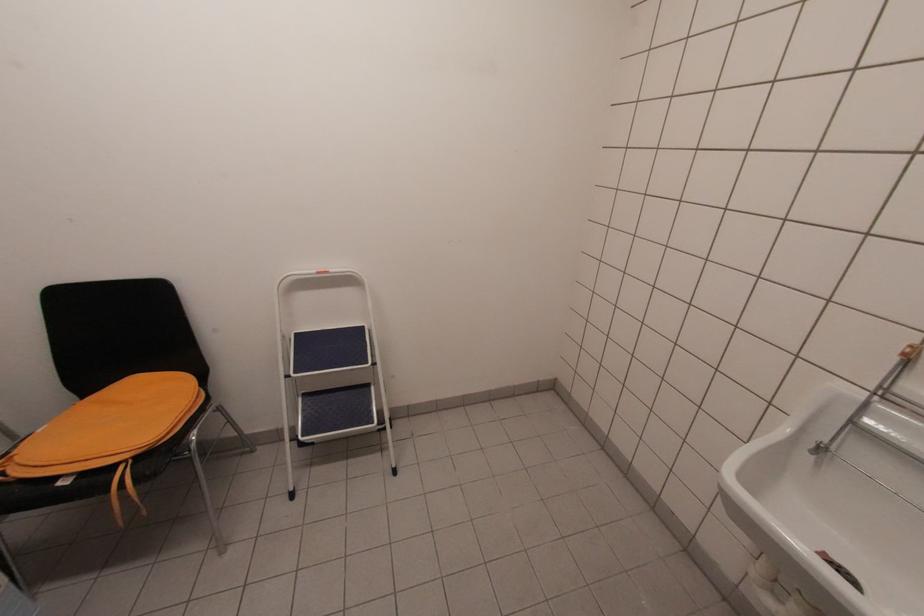
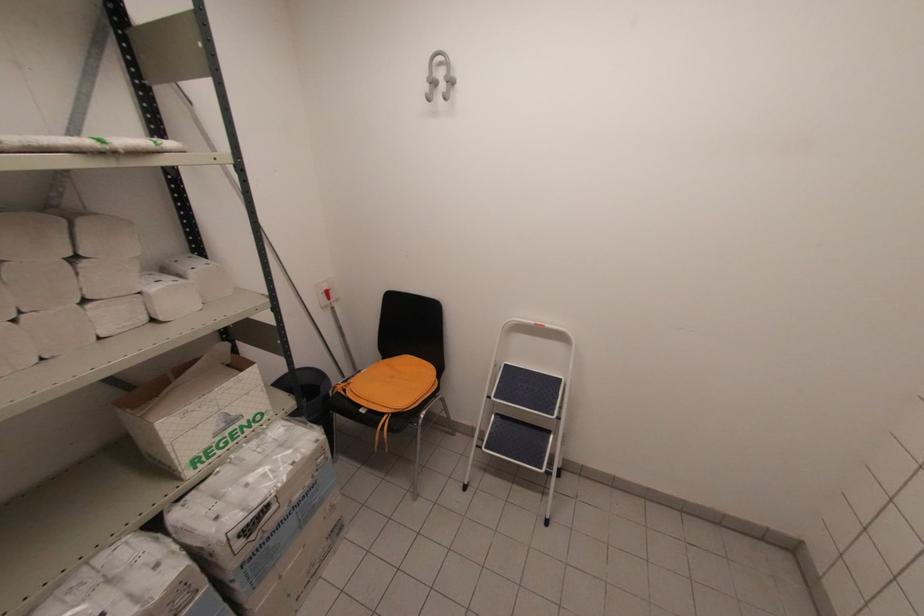
Locate, in the second image, the point that corresponds to (40,432) in the first image.

(362, 371)